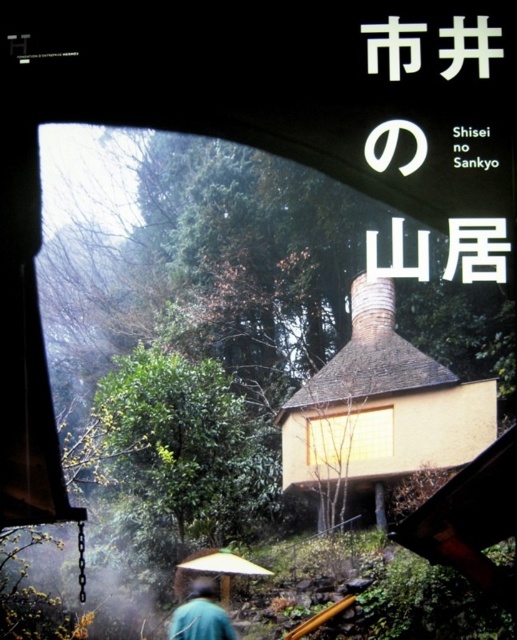
You are standing inside a traditional Japanese building and looking through a window. You see a green matte jacket at lower center and a yellow matte umbrella at lower center. Which object is closer to you?

The green matte jacket at lower center is closer to you because it is in front of the yellow matte umbrella at lower center.

You are standing inside a traditional Japanese house and looking through the window. You notice the green matte jacket at lower center and the yellow matte umbrella at lower center. Which object is closer to the bottom edge of the window frame?

The green matte jacket at lower center is closer to the bottom edge of the window frame because it is positioned below the yellow matte umbrella at lower center.

You are standing inside a traditional Japanese house and notice a green matte jacket at lower center and a yellow matte umbrella at lower center. You want to pick up both items to take them to the entrance. Since you can only carry one item at a time, which item should you pick first to minimize the distance you have to walk?

The green matte jacket at lower center is closer to the yellow matte umbrella at lower center by 34.63 inches. Therefore, you should pick up the green matte jacket at lower center first, then the yellow matte umbrella at lower center to minimize the total distance walked.